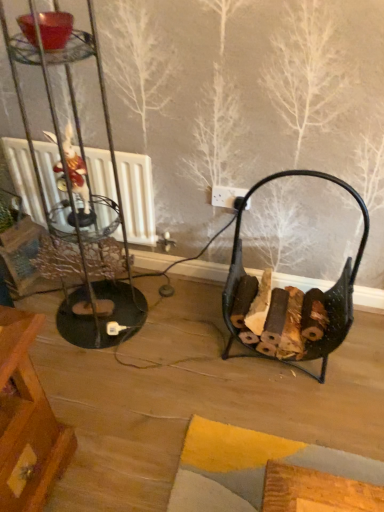
The height and width of the screenshot is (512, 384). In order to click on white plastic socket at center in this screenshot , I will do `click(226, 196)`.

The image size is (384, 512). Describe the element at coordinates (226, 196) in the screenshot. I see `white plastic socket at center` at that location.

This screenshot has height=512, width=384. What do you see at coordinates (288, 286) in the screenshot?
I see `black metal firewood basket at lower right` at bounding box center [288, 286].

What is the approximate height of black metal firewood basket at lower right?

28.66 inches.

Find the location of a particular element. The height and width of the screenshot is (512, 384). black metal firewood basket at lower right is located at coordinates (288, 286).

Where is `white plastic socket at center`? This screenshot has width=384, height=512. white plastic socket at center is located at coordinates (226, 196).

Does black metal firewood basket at lower right appear on the left side of white plastic socket at center?

Incorrect, black metal firewood basket at lower right is not on the left side of white plastic socket at center.

Is the position of black metal firewood basket at lower right more distant than that of white plastic socket at center?

No, black metal firewood basket at lower right is closer to the viewer.

Which is nearer, [276,301] or [233,197]?

Point [276,301] is closer to the camera than point [233,197].

From the image's perspective, would you say black metal firewood basket at lower right is positioned over white plastic socket at center?

No, from the image's perspective, black metal firewood basket at lower right is not on top of white plastic socket at center.

From a real-world perspective, which object stands above the other?

From a 3D spatial view, white plastic socket at center is above.

Considering the relative sizes of black metal firewood basket at lower right and white plastic socket at center in the image provided, is black metal firewood basket at lower right wider than white plastic socket at center?

Correct, the width of black metal firewood basket at lower right exceeds that of white plastic socket at center.

Is black metal firewood basket at lower right shorter than white plastic socket at center?

No.

Considering the relative sizes of black metal firewood basket at lower right and white plastic socket at center in the image provided, is black metal firewood basket at lower right smaller than white plastic socket at center?

No.

Would you say black metal firewood basket at lower right contains white plastic socket at center?

No, white plastic socket at center is not a part of black metal firewood basket at lower right.

From the picture: Is black metal firewood basket at lower right with white plastic socket at center?

No, black metal firewood basket at lower right is not next to white plastic socket at center.

Does black metal firewood basket at lower right turn towards white plastic socket at center?

No, black metal firewood basket at lower right is not oriented towards white plastic socket at center.

What's the angular difference between black metal firewood basket at lower right and white plastic socket at center's facing directions?

There is a 2.52-degree angle between the facing directions of black metal firewood basket at lower right and white plastic socket at center.

How far apart are black metal firewood basket at lower right and white plastic socket at center?

The distance of black metal firewood basket at lower right from white plastic socket at center is 12.92 inches.

In order to click on armchair below the white plastic socket at center (from the image's perspective) in this screenshot , I will do `click(288, 286)`.

Which object is positioned more to the left, white plastic socket at center or black metal firewood basket at lower right?

white plastic socket at center is more to the left.

Between white plastic socket at center and black metal firewood basket at lower right, which one is positioned in front?

black metal firewood basket at lower right is closer to the camera.

Which point is more distant from viewer, (221, 201) or (278, 294)?

Positioned behind is point (221, 201).

From the image's perspective, does white plastic socket at center appear lower than black metal firewood basket at lower right?

Incorrect, from the image's perspective, white plastic socket at center is higher than black metal firewood basket at lower right.

From a real-world perspective, relative to black metal firewood basket at lower right, is white plastic socket at center vertically above or below?

Clearly, from a real-world perspective, white plastic socket at center is above black metal firewood basket at lower right.

Considering the relative sizes of white plastic socket at center and black metal firewood basket at lower right in the image provided, is white plastic socket at center thinner than black metal firewood basket at lower right?

Correct, the width of white plastic socket at center is less than that of black metal firewood basket at lower right.

From their relative heights in the image, would you say white plastic socket at center is taller or shorter than black metal firewood basket at lower right?

Clearly, white plastic socket at center is shorter compared to black metal firewood basket at lower right.

Who is bigger, white plastic socket at center or black metal firewood basket at lower right?

black metal firewood basket at lower right.

Would you say white plastic socket at center contains black metal firewood basket at lower right?

Definitely not — black metal firewood basket at lower right is not inside white plastic socket at center.

From the picture: Is white plastic socket at center positioned far away from black metal firewood basket at lower right?

Actually, white plastic socket at center and black metal firewood basket at lower right are a little close together.

Could you tell me if white plastic socket at center is turned towards black metal firewood basket at lower right?

No, white plastic socket at center is not turned towards black metal firewood basket at lower right.

How many degrees apart are the facing directions of white plastic socket at center and black metal firewood basket at lower right?

They differ by 2.52 degrees in their facing directions.

Find the location of a particular element. electric outlet positioned vertically above the black metal firewood basket at lower right (from a real-world perspective) is located at coordinates (226, 196).

In the image, there is a white plastic socket at center. Where is `armchair below it (from a real-world perspective)`? The width and height of the screenshot is (384, 512). armchair below it (from a real-world perspective) is located at coordinates (288, 286).

The width and height of the screenshot is (384, 512). There is a black metal firewood basket at lower right. Identify the location of electric outlet above it (from a real-world perspective). (226, 196).